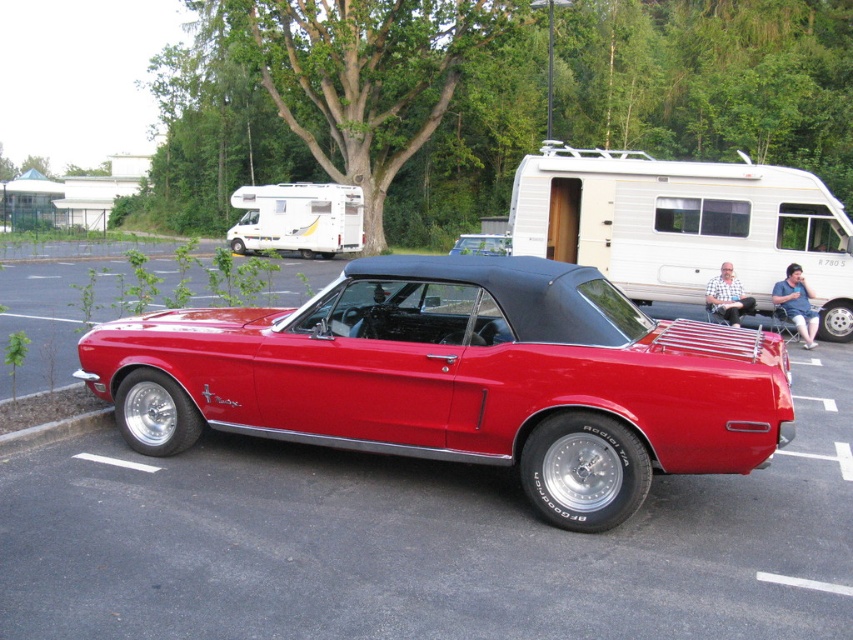
Question: Is shiny red convertible at center below white plastic camper at center?

Choices:
 (A) yes
 (B) no

Answer: (A)

Question: Does shiny red convertible at center appear on the left side of white plastic camper at center?

Choices:
 (A) no
 (B) yes

Answer: (B)

Question: Which point is closer to the camera?

Choices:
 (A) (779, 269)
 (B) (474, 422)

Answer: (B)

Question: Does shiny red convertible at center have a lesser width compared to white plastic camper at center?

Choices:
 (A) yes
 (B) no

Answer: (A)